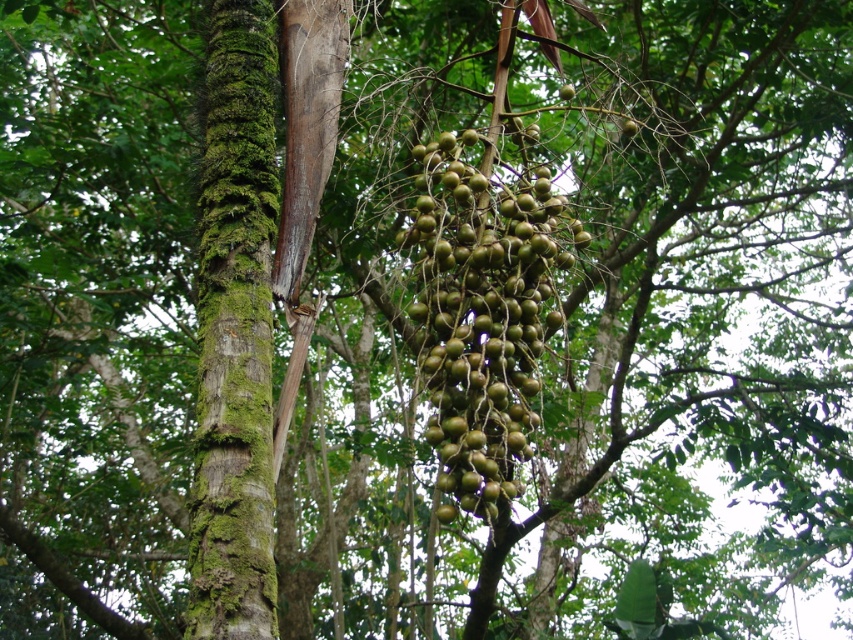
You are a botanist studying the forest scene. You need to determine the relative positions of the green mossy bark at center and the green matte cluster at center. Which object is located to the left of the other?

The green mossy bark at center is positioned on the left side of green matte cluster at center.